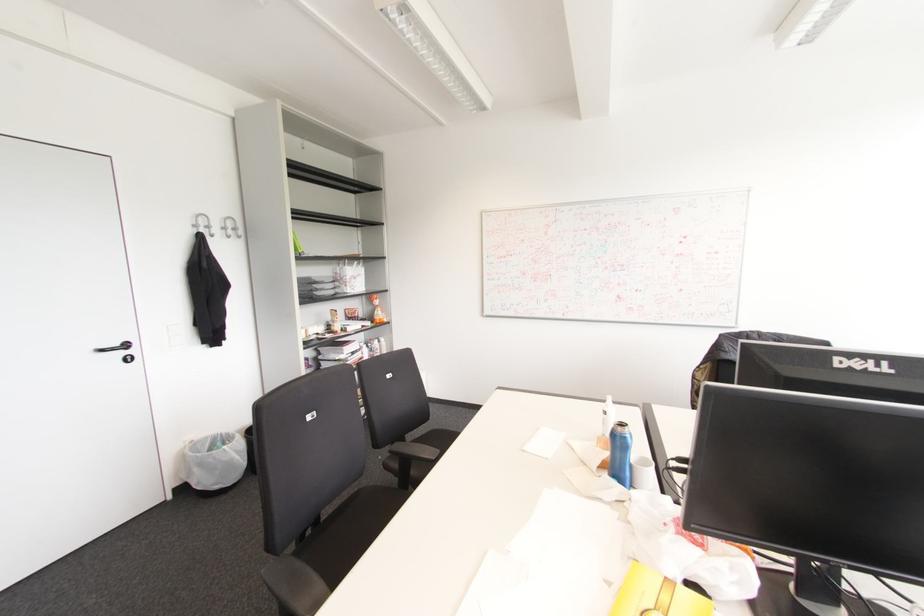
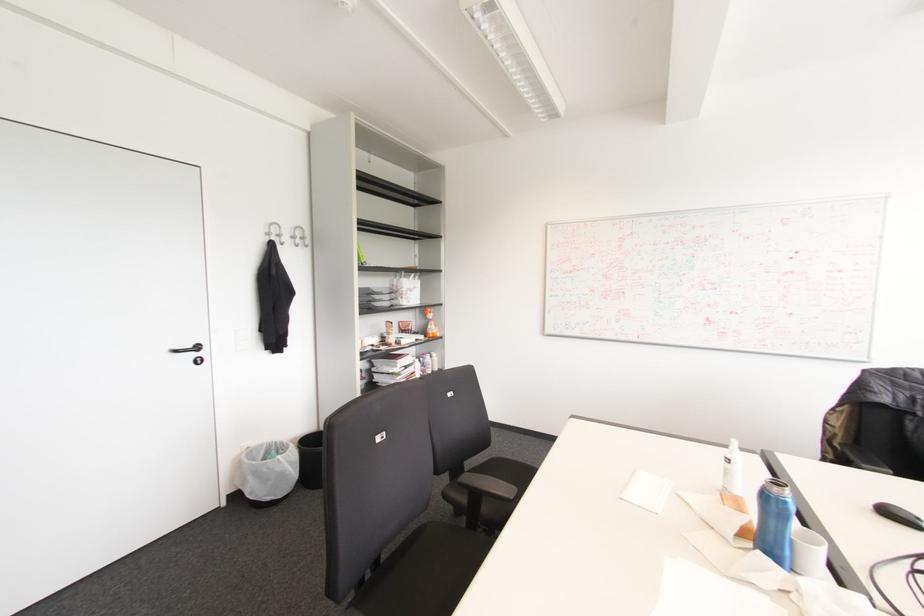
Where in the second image is the point corresponding to pixel 195 225 from the first image?

(266, 233)